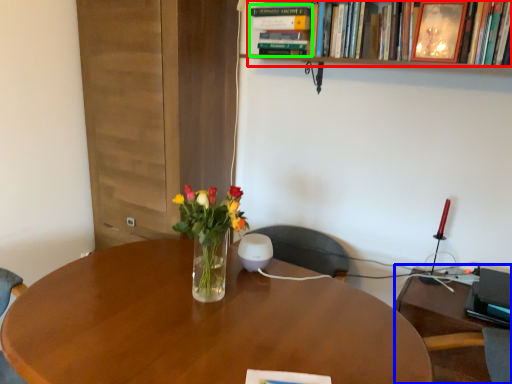
Question: Considering the real-world distances, which object is farthest from book (highlighted by a red box)? computer desk (highlighted by a blue box) or book (highlighted by a green box)?

Choices:
 (A) computer desk
 (B) book

Answer: (A)